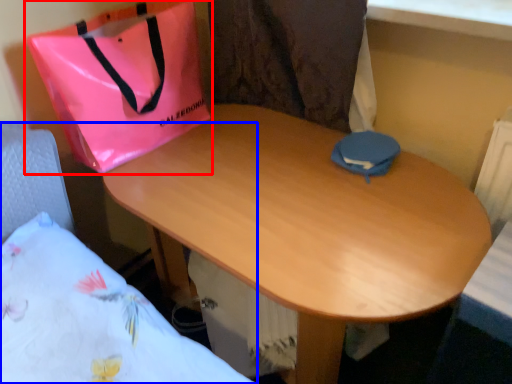
Question: Which of the following is the closest to the observer, handbag (highlighted by a red box) or bed (highlighted by a blue box)?

Choices:
 (A) handbag
 (B) bed

Answer: (B)